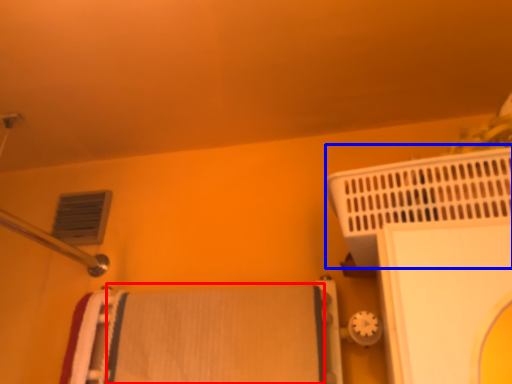
Question: Which point is further to the camera, bath towel (highlighted by a red box) or bath heater (highlighted by a blue box)?

Choices:
 (A) bath towel
 (B) bath heater

Answer: (A)